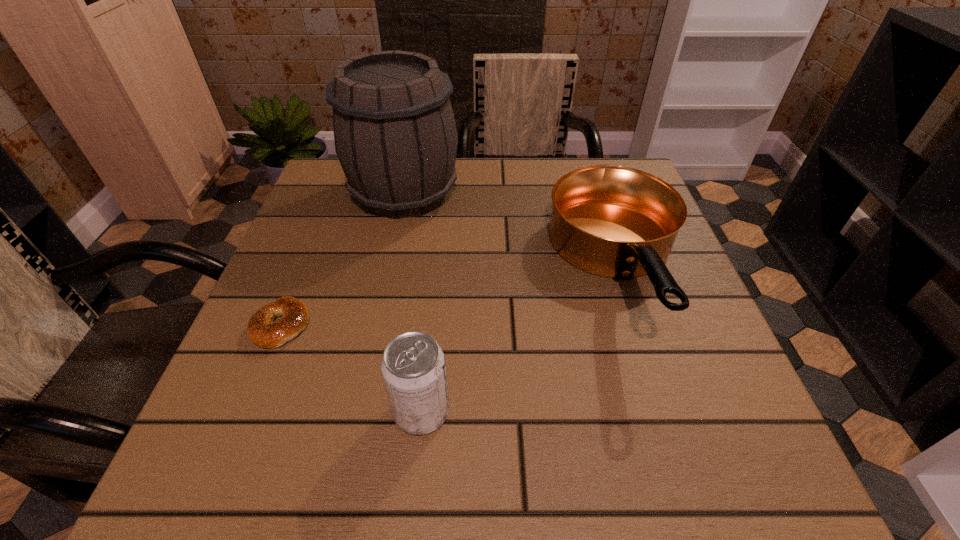
The width and height of the screenshot is (960, 540). Identify the location of free space between the tallest object and the bagel. (343, 259).

Find the location of `unoccupied position between the rightmost object and the wine bucket`. unoccupied position between the rightmost object and the wine bucket is located at coordinates (512, 232).

I want to click on free space between the soda can and the bagel, so click(x=351, y=368).

Locate an element on the screen. free space between the tallest object and the bagel is located at coordinates (343, 259).

Identify which object is the third nearest to the frying pan. Please provide its 2D coordinates. Your answer should be formatted as a tuple, i.e. [(x, y)], where the tuple contains the x and y coordinates of a point satisfying the conditions above.

[(261, 330)]

Where is `object that is the second closest to the wine bucket`? object that is the second closest to the wine bucket is located at coordinates (261, 330).

Identify the location of vacant space that satisfies the following two spatial constraints: 1. on the front side of the tallest object; 2. on the left side of the soda can. This screenshot has height=540, width=960. (358, 411).